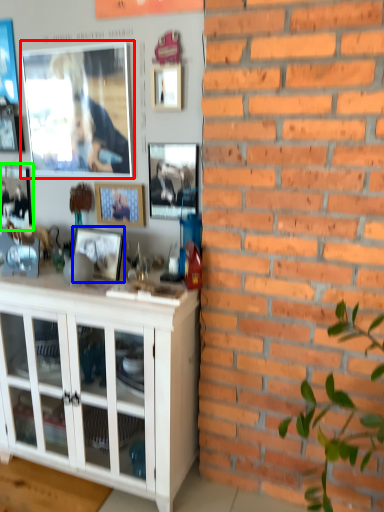
Question: Which object is positioned farthest from picture frame (highlighted by a red box)? Select from picture frame (highlighted by a blue box) and picture frame (highlighted by a green box).

Choices:
 (A) picture frame
 (B) picture frame

Answer: (A)